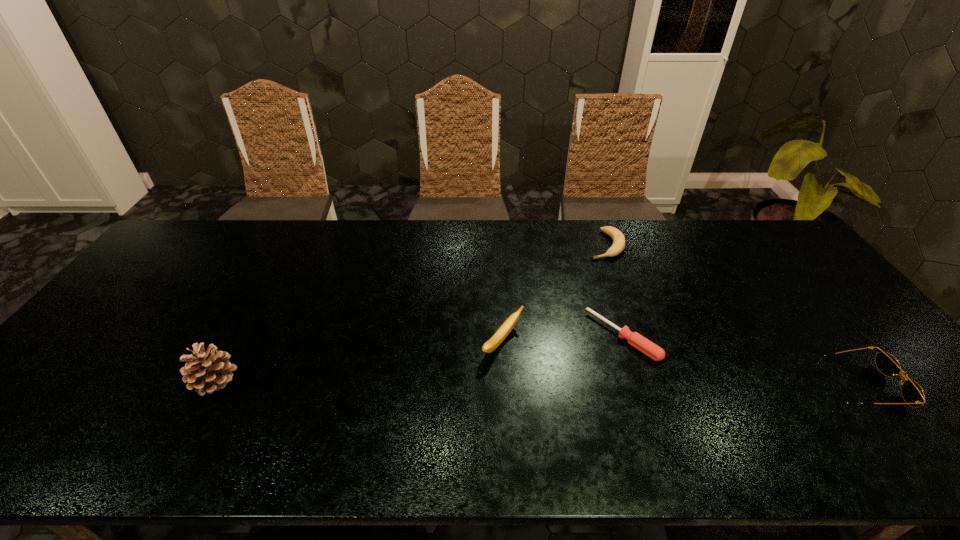
The image size is (960, 540). In order to click on object that can be found as the second closest to the third shortest object in this screenshot , I will do `click(618, 245)`.

The width and height of the screenshot is (960, 540). I want to click on free region that satisfies the following two spatial constraints: 1. on the back side of the screwdriver; 2. on the left side of the fourth tallest object, so click(x=593, y=245).

At what (x,y) coordinates should I click in order to perform the action: click on free space that satisfies the following two spatial constraints: 1. on the front side of the leftmost object; 2. on the front-facing side of the sunglasses. Please return your answer as a coordinate pair (x, y). Looking at the image, I should click on (212, 386).

Image resolution: width=960 pixels, height=540 pixels. I want to click on vacant space that satisfies the following two spatial constraints: 1. on the front side of the rightmost object; 2. on the front-facing side of the second shortest object, so click(655, 386).

The width and height of the screenshot is (960, 540). I want to click on vacant area that satisfies the following two spatial constraints: 1. on the back side of the screwdriver; 2. on the right side of the pinecone, so click(x=239, y=336).